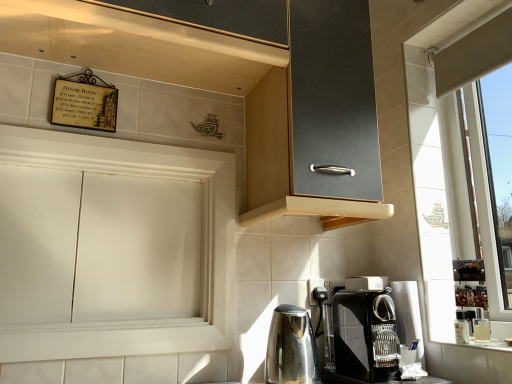
Describe the element at coordinates (113, 247) in the screenshot. I see `white matte cabinet at left, the first cabinetry in the bottom-to-top sequence` at that location.

You are a GUI agent. You are given a task and a screenshot of the screen. Output one action in this format:
    pyautogui.click(x=<x>, y=<y>)
    Task: Click on the matte black cabinet at upper center, the 2th cabinetry from the bottom
    The image size is (512, 384).
    Given the screenshot: What is the action you would take?
    pyautogui.click(x=246, y=92)

In order to click on coffee maker that is above the polished stainless steel kettle at lower center (from the image's perspective) in this screenshot , I will do `click(365, 335)`.

Can you confirm if polished stainless steel kettle at lower center is shorter than black glossy coffee maker at lower right?

Yes, polished stainless steel kettle at lower center is shorter than black glossy coffee maker at lower right.

Which object is closer to the camera taking this photo, polished stainless steel kettle at lower center or black glossy coffee maker at lower right?

black glossy coffee maker at lower right.

From a real-world perspective, which object rests below the other?

From a 3D spatial view, polished stainless steel kettle at lower center is below.

Is point (361, 380) positioned after point (360, 76)?

That is False.

Looking at this image, from the image's perspective, would you say black glossy coffee maker at lower right is positioned over matte black cabinet at upper center, the 2th cabinetry from the bottom?

Incorrect, from the image's perspective, black glossy coffee maker at lower right is lower than matte black cabinet at upper center, the 2th cabinetry from the bottom.

From a real-world perspective, is black glossy coffee maker at lower right on top of matte black cabinet at upper center, marked as the first cabinetry in a top-to-bottom arrangement?

No.

At what (x,y) coordinates should I click in order to perform the action: click on home appliance on the right side of white matte cabinet at left, the 2th cabinetry in the top-to-bottom sequence. Please return your answer as a coordinate pair (x, y). The height and width of the screenshot is (384, 512). Looking at the image, I should click on (291, 348).

From the image's perspective, is polished stainless steel kettle at lower center above white matte cabinet at left, the 2th cabinetry in the top-to-bottom sequence?

Incorrect, from the image's perspective, polished stainless steel kettle at lower center is lower than white matte cabinet at left, the 2th cabinetry in the top-to-bottom sequence.

Based on their positions, is polished stainless steel kettle at lower center located to the left or right of white matte cabinet at left, the first cabinetry in the bottom-to-top sequence?

Based on their positions, polished stainless steel kettle at lower center is located to the right of white matte cabinet at left, the first cabinetry in the bottom-to-top sequence.

Is polished stainless steel kettle at lower center next to white matte cabinet at left, the 2th cabinetry in the top-to-bottom sequence, and touching it?

There is a gap between polished stainless steel kettle at lower center and white matte cabinet at left, the 2th cabinetry in the top-to-bottom sequence.

In the image, is polished stainless steel kettle at lower center on the left side or the right side of matte black cabinet at upper center, marked as the first cabinetry in a top-to-bottom arrangement?

polished stainless steel kettle at lower center is positioned on matte black cabinet at upper center, marked as the first cabinetry in a top-to-bottom arrangement,'s right side.

From the image's perspective, is polished stainless steel kettle at lower center on matte black cabinet at upper center, marked as the first cabinetry in a top-to-bottom arrangement?

No, from the image's perspective, polished stainless steel kettle at lower center is not on top of matte black cabinet at upper center, marked as the first cabinetry in a top-to-bottom arrangement.

Can we say polished stainless steel kettle at lower center lies outside matte black cabinet at upper center, the 2th cabinetry from the bottom?

Yes, polished stainless steel kettle at lower center is located beyond the bounds of matte black cabinet at upper center, the 2th cabinetry from the bottom.

Is polished stainless steel kettle at lower center turned away from matte black cabinet at upper center, marked as the first cabinetry in a top-to-bottom arrangement?

No, polished stainless steel kettle at lower center is not facing away from matte black cabinet at upper center, marked as the first cabinetry in a top-to-bottom arrangement.

Can you confirm if black glossy coffee maker at lower right is positioned to the left of polished stainless steel kettle at lower center?

Incorrect, black glossy coffee maker at lower right is not on the left side of polished stainless steel kettle at lower center.

From the image's perspective, would you say black glossy coffee maker at lower right is positioned over polished stainless steel kettle at lower center?

Correct, black glossy coffee maker at lower right appears higher than polished stainless steel kettle at lower center in the image.

Measure the distance between black glossy coffee maker at lower right and polished stainless steel kettle at lower center.

black glossy coffee maker at lower right is 6.75 inches from polished stainless steel kettle at lower center.

Considering the sizes of black glossy coffee maker at lower right and polished stainless steel kettle at lower center in the image, is black glossy coffee maker at lower right wider or thinner than polished stainless steel kettle at lower center?

black glossy coffee maker at lower right is wider than polished stainless steel kettle at lower center.

Is black glossy coffee maker at lower right with white matte cabinet at left, the 2th cabinetry in the top-to-bottom sequence?

No, black glossy coffee maker at lower right is not with white matte cabinet at left, the 2th cabinetry in the top-to-bottom sequence.

From a real-world perspective, which is physically below, black glossy coffee maker at lower right or white matte cabinet at left, the first cabinetry in the bottom-to-top sequence?

black glossy coffee maker at lower right is physically lower.

Does black glossy coffee maker at lower right turn towards white matte cabinet at left, the first cabinetry in the bottom-to-top sequence?

No, black glossy coffee maker at lower right is not turned towards white matte cabinet at left, the first cabinetry in the bottom-to-top sequence.

Which object is closer to the camera, black glossy coffee maker at lower right or white matte cabinet at left, the first cabinetry in the bottom-to-top sequence?

Positioned in front is black glossy coffee maker at lower right.

Considering the relative sizes of matte black cabinet at upper center, marked as the first cabinetry in a top-to-bottom arrangement, and white matte cabinet at left, the first cabinetry in the bottom-to-top sequence, in the image provided, is matte black cabinet at upper center, marked as the first cabinetry in a top-to-bottom arrangement, smaller than white matte cabinet at left, the first cabinetry in the bottom-to-top sequence,?

No.

From the image's perspective, would you say matte black cabinet at upper center, the 2th cabinetry from the bottom, is positioned over white matte cabinet at left, the 2th cabinetry in the top-to-bottom sequence?

Yes, from the image's perspective, matte black cabinet at upper center, the 2th cabinetry from the bottom, is over white matte cabinet at left, the 2th cabinetry in the top-to-bottom sequence.

Considering the points (362, 45) and (57, 220), which point is in front, point (362, 45) or point (57, 220)?

Positioned in front is point (57, 220).

Find the location of a particular element. cabinetry in front of the white matte cabinet at left, the 2th cabinetry in the top-to-bottom sequence is located at coordinates (246, 92).

What are the coordinates of `home appliance that appears on the left of black glossy coffee maker at lower right` in the screenshot? It's located at (291, 348).

Locate an element on the screen. The height and width of the screenshot is (384, 512). cabinetry in front of the black glossy coffee maker at lower right is located at coordinates (246, 92).

Which object lies further to the anchor point polished stainless steel kettle at lower center, black glossy coffee maker at lower right or matte black cabinet at upper center, marked as the first cabinetry in a top-to-bottom arrangement?

Among the two, matte black cabinet at upper center, marked as the first cabinetry in a top-to-bottom arrangement, is located further to polished stainless steel kettle at lower center.

Looking at the image, which one is located further to black glossy coffee maker at lower right, matte black cabinet at upper center, the 2th cabinetry from the bottom, or polished stainless steel kettle at lower center?

matte black cabinet at upper center, the 2th cabinetry from the bottom, is further to black glossy coffee maker at lower right.

When comparing their distances from polished stainless steel kettle at lower center, does white matte cabinet at left, the 2th cabinetry in the top-to-bottom sequence, or matte black cabinet at upper center, marked as the first cabinetry in a top-to-bottom arrangement, seem further?

matte black cabinet at upper center, marked as the first cabinetry in a top-to-bottom arrangement, is further to polished stainless steel kettle at lower center.

Based on their spatial positions, is polished stainless steel kettle at lower center or white matte cabinet at left, the 2th cabinetry in the top-to-bottom sequence, closer to black glossy coffee maker at lower right?

polished stainless steel kettle at lower center lies closer to black glossy coffee maker at lower right than the other object.

Estimate the real-world distances between objects in this image. Which object is closer to black glossy coffee maker at lower right, polished stainless steel kettle at lower center or matte black cabinet at upper center, the 2th cabinetry from the bottom?

polished stainless steel kettle at lower center.

Estimate the real-world distances between objects in this image. Which object is further from polished stainless steel kettle at lower center, white matte cabinet at left, the first cabinetry in the bottom-to-top sequence, or black glossy coffee maker at lower right?

Among the two, white matte cabinet at left, the first cabinetry in the bottom-to-top sequence, is located further to polished stainless steel kettle at lower center.

Looking at this image, based on their spatial positions, is polished stainless steel kettle at lower center or black glossy coffee maker at lower right further from matte black cabinet at upper center, marked as the first cabinetry in a top-to-bottom arrangement?

polished stainless steel kettle at lower center.

Based on their spatial positions, is black glossy coffee maker at lower right or white matte cabinet at left, the first cabinetry in the bottom-to-top sequence, closer to matte black cabinet at upper center, the 2th cabinetry from the bottom?

Based on the image, white matte cabinet at left, the first cabinetry in the bottom-to-top sequence, appears to be nearer to matte black cabinet at upper center, the 2th cabinetry from the bottom.

Locate an element on the screen. The height and width of the screenshot is (384, 512). cabinetry between matte black cabinet at upper center, marked as the first cabinetry in a top-to-bottom arrangement, and polished stainless steel kettle at lower center vertically is located at coordinates (113, 247).

Where is `coffee maker between matte black cabinet at upper center, the 2th cabinetry from the bottom, and polished stainless steel kettle at lower center, in the vertical direction`? The height and width of the screenshot is (384, 512). coffee maker between matte black cabinet at upper center, the 2th cabinetry from the bottom, and polished stainless steel kettle at lower center, in the vertical direction is located at coordinates (365, 335).

This screenshot has height=384, width=512. Find the location of `cabinetry situated between white matte cabinet at left, the 2th cabinetry in the top-to-bottom sequence, and black glossy coffee maker at lower right from left to right`. cabinetry situated between white matte cabinet at left, the 2th cabinetry in the top-to-bottom sequence, and black glossy coffee maker at lower right from left to right is located at coordinates (246, 92).

The height and width of the screenshot is (384, 512). I want to click on home appliance between white matte cabinet at left, the 2th cabinetry in the top-to-bottom sequence, and black glossy coffee maker at lower right, so click(x=291, y=348).